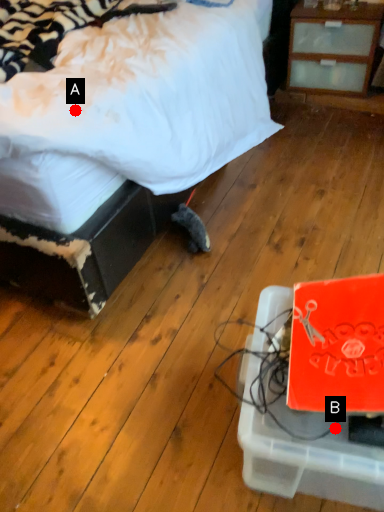
Question: Two points are circled on the image, labeled by A and B beside each circle. Among these points, which one is nearest to the camera?

Choices:
 (A) A is closer
 (B) B is closer

Answer: (B)